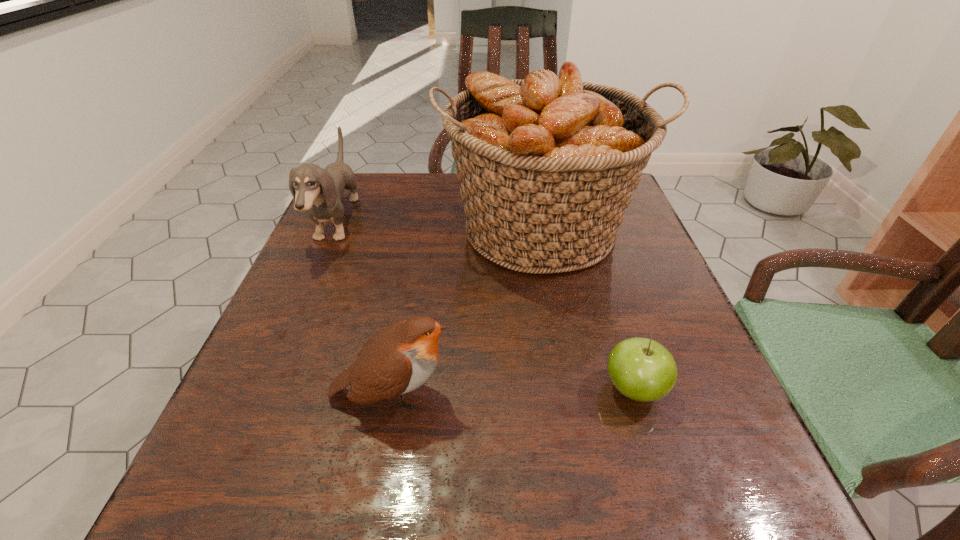
Identify the location of vacant space at the far left corner of the desktop. This screenshot has width=960, height=540. (375, 184).

The image size is (960, 540). In order to click on empty space between the third tallest object and the apple in this screenshot , I will do `click(514, 392)`.

You are a GUI agent. You are given a task and a screenshot of the screen. Output one action in this format:
    pyautogui.click(x=<x>, y=<y>)
    Task: Click on the vacant space that is in between the leftmost object and the basket
    
    Given the screenshot: What is the action you would take?
    pyautogui.click(x=439, y=226)

Where is `vacant space that is in between the puppy and the apple`? Image resolution: width=960 pixels, height=540 pixels. vacant space that is in between the puppy and the apple is located at coordinates (485, 306).

Identify the location of vacant space that is in between the second shortest object and the apple. This screenshot has height=540, width=960. (514, 392).

At what (x,y) coordinates should I click in order to perform the action: click on vacant region between the shortest object and the leftmost object. Please return your answer as a coordinate pair (x, y). Looking at the image, I should click on (485, 306).

Identify the location of free space between the basket and the puppy. (439, 226).

In order to click on free space between the apple and the bird in this screenshot , I will do click(x=514, y=392).

The width and height of the screenshot is (960, 540). In order to click on free space between the puppy and the bird in this screenshot , I will do `click(365, 308)`.

This screenshot has width=960, height=540. I want to click on free space between the puppy and the shortest object, so click(485, 306).